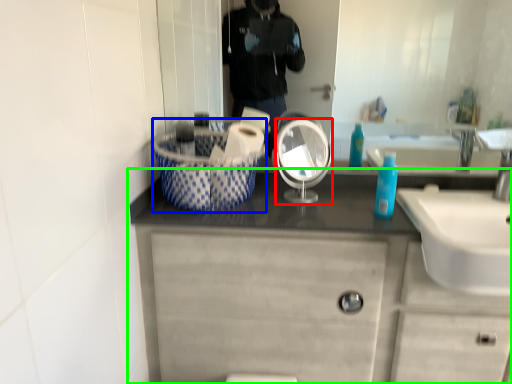
Question: Based on their relative distances, which object is nearer to mirror (highlighted by a red box)? Choose from basket (highlighted by a blue box) and bathroom cabinet (highlighted by a green box).

Choices:
 (A) basket
 (B) bathroom cabinet

Answer: (A)